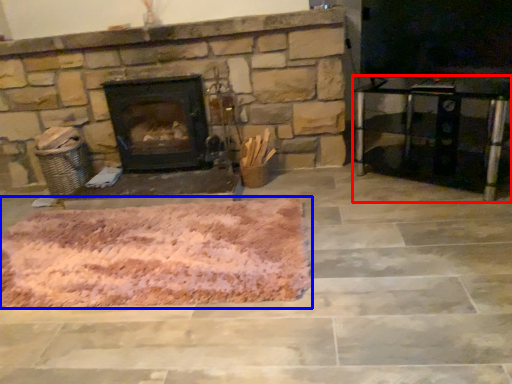
Question: Which of the following is the farthest to the observer, entertainment center (highlighted by a red box) or mat (highlighted by a blue box)?

Choices:
 (A) entertainment center
 (B) mat

Answer: (A)